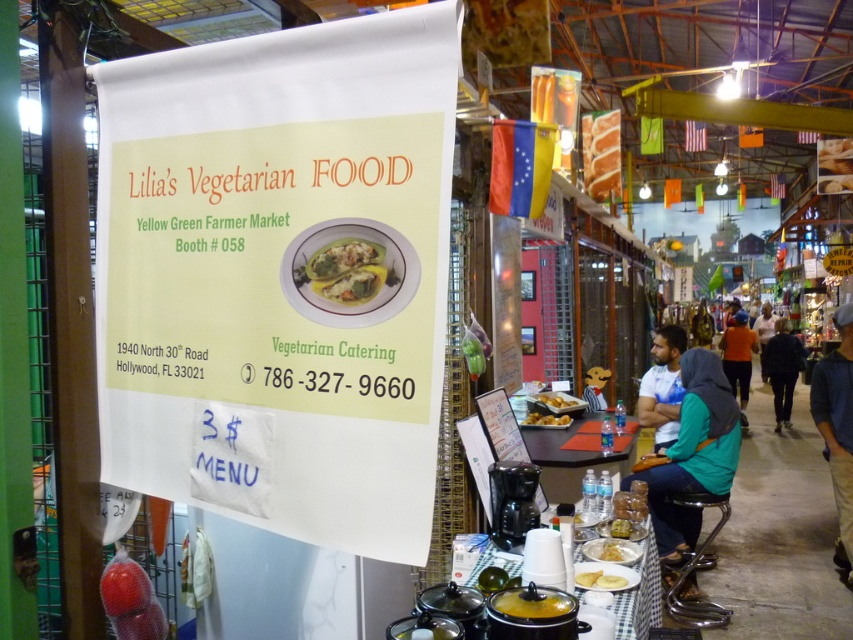
Question: From the image, what is the correct spatial relationship of golden brown crispy pastry at lower center in relation to golden crispy pastry at center?

Choices:
 (A) above
 (B) below

Answer: (B)

Question: Among these objects, which one is farthest from the camera?

Choices:
 (A) white glossy plate at lower center
 (B) teal fabric hijab at lower right
 (C) blue fabric at center

Answer: (C)

Question: Observing the image, what is the correct spatial positioning of teal fabric hijab at lower right in reference to white glossy plate at lower center?

Choices:
 (A) left
 (B) right

Answer: (B)

Question: Which of the following is the farthest from the observer?

Choices:
 (A) pos(299,268)
 (B) pos(679,481)
 (C) pos(538,397)
 (D) pos(612,544)

Answer: (C)

Question: Which point appears closest to the camera in this image?

Choices:
 (A) (772, 380)
 (B) (612, 573)

Answer: (B)

Question: Does white matte bread at lower center lie behind golden crispy pastry at center?

Choices:
 (A) no
 (B) yes

Answer: (A)